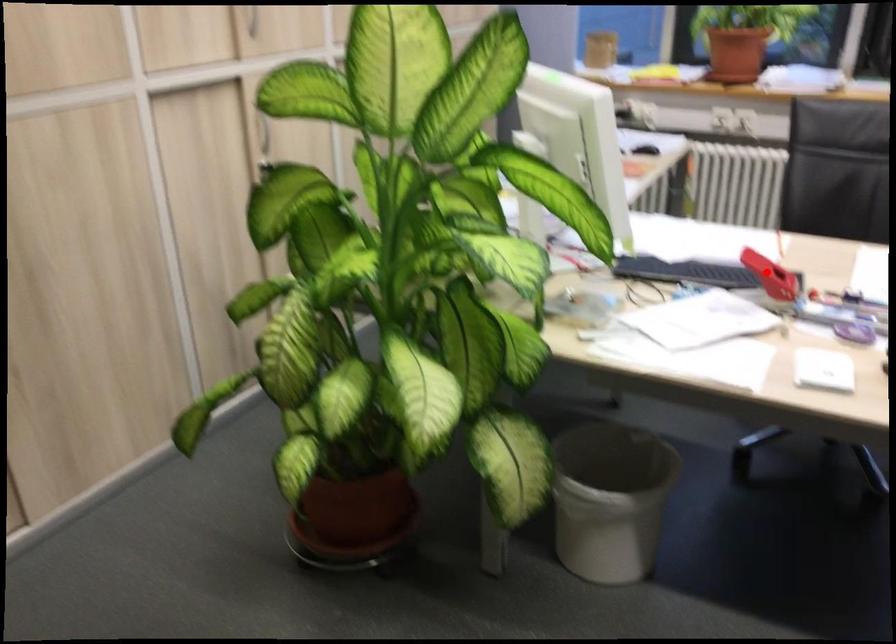
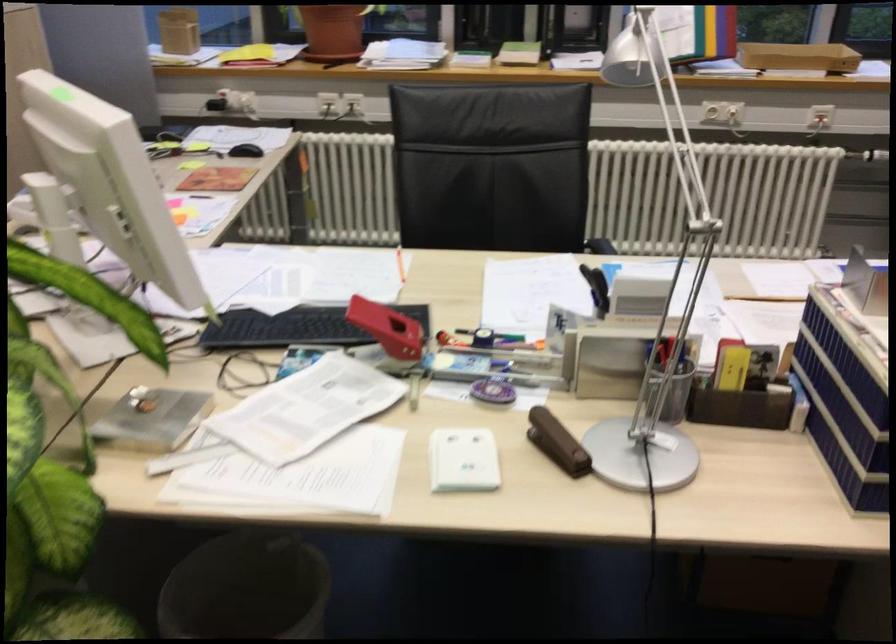
In the second image, find the point that corresponds to the highlighted location in the first image.

(388, 328)